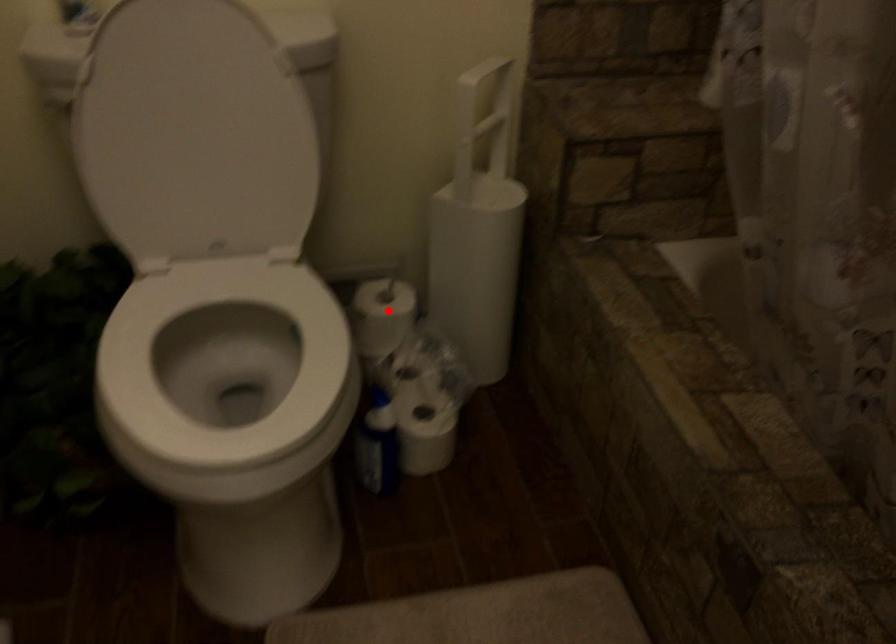
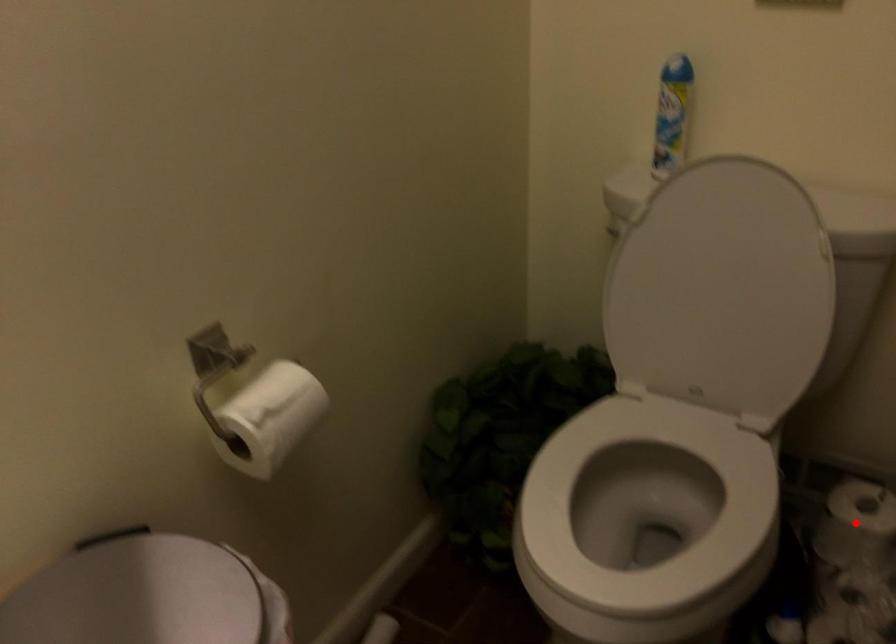
I am providing you with two images of the same scene from different viewpoints. A red point is marked on the first image and another point is marked on the second image. Do the highlighted points in image1 and image2 indicate the same real-world spot?

Yes